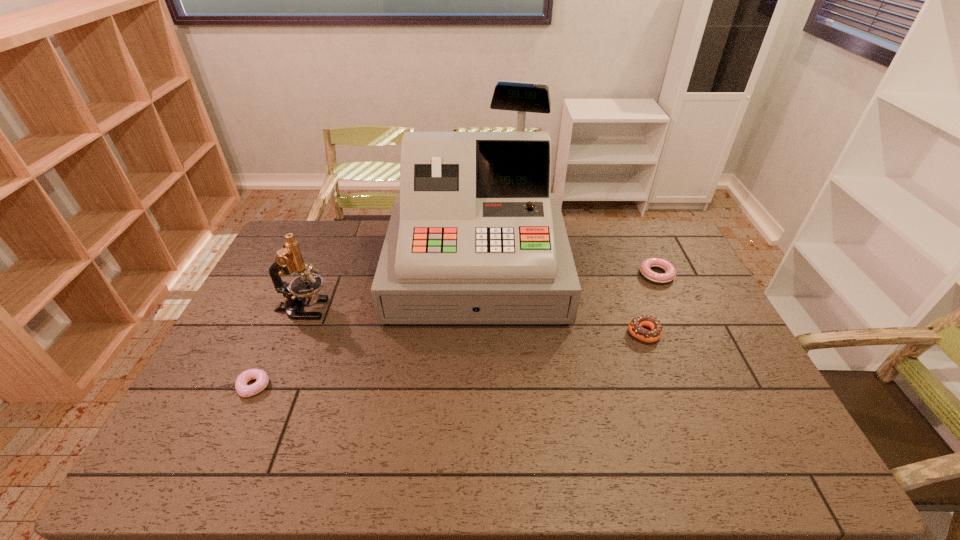
Find the location of a particular element. The width and height of the screenshot is (960, 540). free space located at the eyepiece of the microscope is located at coordinates (406, 309).

Where is `free point located 0.080m on the right of the third shortest object`? This screenshot has width=960, height=540. free point located 0.080m on the right of the third shortest object is located at coordinates (688, 333).

Find the location of a particular element. vacant space located 0.050m on the front of the rightmost doughnut is located at coordinates (666, 296).

Locate an element on the screen. The width and height of the screenshot is (960, 540). blank space located on the back of the leftmost doughnut is located at coordinates (300, 286).

Image resolution: width=960 pixels, height=540 pixels. I want to click on object that is at the far edge, so 475,236.

Find the location of `microscope located at the left edge`. microscope located at the left edge is located at coordinates (303, 290).

Find the location of a particular element. doughnut that is at the left edge is located at coordinates (244, 390).

Image resolution: width=960 pixels, height=540 pixels. Find the location of `object located in the right edge section of the desktop`. object located in the right edge section of the desktop is located at coordinates (647, 273).

Find the location of `free space at the far edge of the desktop`. free space at the far edge of the desktop is located at coordinates (369, 257).

In the image, there is a desktop. Where is `vacant space at the near edge`? This screenshot has height=540, width=960. vacant space at the near edge is located at coordinates (556, 465).